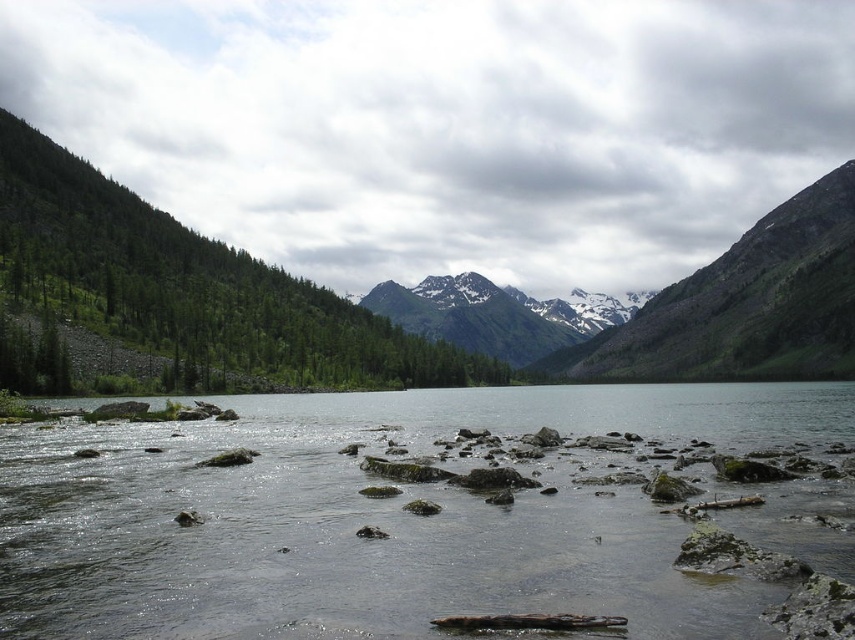
Question: Which point is farther from the camera taking this photo?

Choices:
 (A) coord(286,374)
 (B) coord(296,516)

Answer: (A)

Question: Does clear water at center have a larger size compared to snowy granite mountain at center?

Choices:
 (A) yes
 (B) no

Answer: (B)

Question: Which of the following is the closest to the observer?

Choices:
 (A) clear water at center
 (B) snowy granite mountain at center
 (C) green matte tree at left

Answer: (A)

Question: Which point appears farthest from the camera in this image?

Choices:
 (A) (588, 321)
 (B) (652, 579)
 (C) (295, 353)

Answer: (A)

Question: From the image, what is the correct spatial relationship of green matte tree at left in relation to snowy granite mountain at center?

Choices:
 (A) below
 (B) above

Answer: (B)

Question: Is green matte tree at left wider than snowy granite mountain at center?

Choices:
 (A) yes
 (B) no

Answer: (B)